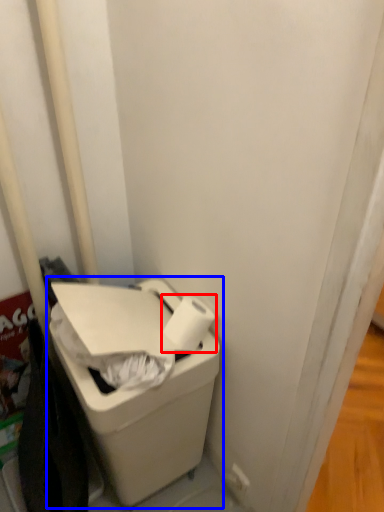
Question: Among these objects, which one is farthest to the camera, toilet paper (highlighted by a red box) or waste container (highlighted by a blue box)?

Choices:
 (A) toilet paper
 (B) waste container

Answer: (A)